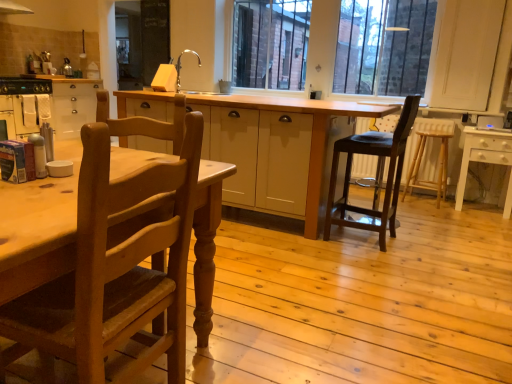
You are a GUI agent. You are given a task and a screenshot of the screen. Output one action in this format:
    pyautogui.click(x=<x>, y=<y>)
    Task: Click on the dark brown wood stool at center-right, placed as the first chair when sorted from right to left
    The height and width of the screenshot is (384, 512).
    Given the screenshot: What is the action you would take?
    pyautogui.click(x=387, y=177)

This screenshot has height=384, width=512. What do you see at coordinates (423, 154) in the screenshot? I see `light brown wooden bar stool at right` at bounding box center [423, 154].

I want to click on silver metallic sink at upper center, so click(195, 70).

The height and width of the screenshot is (384, 512). In order to click on light brown wood chair at left, the second chair in the right-to-left sequence in this screenshot , I will do `click(114, 269)`.

In order to face metallic silver oven at left, should I rotate leftwards or rightwards?

To face it directly, rotate left by 29.960 degrees.

Describe the element at coordinates (25, 113) in the screenshot. I see `metallic silver oven at left` at that location.

Locate an element on the screen. The height and width of the screenshot is (384, 512). light wood table at center, which appears as the 2th table when viewed from the right is located at coordinates (277, 150).

Is white matte cabinet at left wider or thinner than dark brown wood stool at center-right, which appears as the second chair when viewed from the front?

Clearly, white matte cabinet at left has more width compared to dark brown wood stool at center-right, which appears as the second chair when viewed from the front.

Find the location of `cabinetry on the left of dark brown wood stool at center-right, placed as the first chair when sorted from right to left`. cabinetry on the left of dark brown wood stool at center-right, placed as the first chair when sorted from right to left is located at coordinates (50, 104).

Which is closer, (41,99) or (346,141)?

Clearly, point (41,99) is more distant from the camera than point (346,141).

Considering the sizes of white matte cabinet at left and dark brown wood stool at center-right, placed as the first chair when sorted from right to left, in the image, is white matte cabinet at left taller or shorter than dark brown wood stool at center-right, placed as the first chair when sorted from right to left,?

Considering their sizes, white matte cabinet at left has less height than dark brown wood stool at center-right, placed as the first chair when sorted from right to left.

Could you measure the distance between white glossy table at right, marked as the 1th table in a right-to-left arrangement, and dark brown wood stool at center-right, placed as the 1th chair when sorted from back to front?

They are 1.31 meters apart.

Is point (509, 180) behind point (390, 163)?

Yes, point (509, 180) is farther from viewer.

Is white glossy table at right, marked as the 1th table in a right-to-left arrangement, further to the viewer compared to dark brown wood stool at center-right, placed as the 1th chair when sorted from back to front?

Yes, the depth of white glossy table at right, marked as the 1th table in a right-to-left arrangement, is greater than that of dark brown wood stool at center-right, placed as the 1th chair when sorted from back to front.

You are a GUI agent. You are given a task and a screenshot of the screen. Output one action in this format:
    pyautogui.click(x=<x>, y=<y>)
    Task: Click on the 2nd table behind the dark brown wood stool at center-right, which appears as the second chair when viewed from the front, counting from the anchor's position
    The image size is (512, 384).
    Given the screenshot: What is the action you would take?
    pyautogui.click(x=485, y=159)

Which of these two, light wood table at center, which appears as the 2th table when viewed from the right, or white glossy table at right, marked as the 1th table in a right-to-left arrangement, is smaller?

white glossy table at right, marked as the 1th table in a right-to-left arrangement.

What's the angular difference between light wood table at center, which is the first table from left to right, and white glossy table at right, positioned as the second table in left-to-right order,'s facing directions?

There is a 0.727-degree angle between the facing directions of light wood table at center, which is the first table from left to right, and white glossy table at right, positioned as the second table in left-to-right order.

Is light wood table at center, which appears as the 2th table when viewed from the right, wider than white glossy table at right, marked as the 1th table in a right-to-left arrangement?

Correct, the width of light wood table at center, which appears as the 2th table when viewed from the right, exceeds that of white glossy table at right, marked as the 1th table in a right-to-left arrangement.

Are light wood table at center, which appears as the 2th table when viewed from the right, and white glossy table at right, marked as the 1th table in a right-to-left arrangement, making contact?

No, light wood table at center, which appears as the 2th table when viewed from the right, is not beside white glossy table at right, marked as the 1th table in a right-to-left arrangement.

Consider the image. From the image's perspective, is white glossy table at right, positioned as the second table in left-to-right order, over white matte cabinet at left?

No, from the image's perspective, white glossy table at right, positioned as the second table in left-to-right order, is not on top of white matte cabinet at left.

Is white glossy table at right, marked as the 1th table in a right-to-left arrangement, oriented away from white matte cabinet at left?

No, white matte cabinet at left is not at the back of white glossy table at right, marked as the 1th table in a right-to-left arrangement.

Is white glossy table at right, positioned as the second table in left-to-right order, closer to the viewer compared to white matte cabinet at left?

Yes, white glossy table at right, positioned as the second table in left-to-right order, is closer to the viewer.

Find the location of a particular element. the 2nd table positioned below the white matte cabinet at left (from a real-world perspective) is located at coordinates (485, 159).

Considering the positions of points (332, 176) and (170, 357), is point (332, 176) closer to camera compared to point (170, 357)?

No, it is not.

Would you say dark brown wood stool at center-right, placed as the first chair when sorted from right to left, is inside or outside light brown wood chair at left, which is counted as the 2th chair, starting from the back?

dark brown wood stool at center-right, placed as the first chair when sorted from right to left, is not inside light brown wood chair at left, which is counted as the 2th chair, starting from the back, it's outside.

Measure the distance between dark brown wood stool at center-right, placed as the 1th chair when sorted from back to front, and light brown wood chair at left, the 1th chair viewed from the left.

1.90 meters.

Considering the sizes of objects dark brown wood stool at center-right, which appears as the second chair when viewed from the front, and light brown wood chair at left, which is counted as the 2th chair, starting from the back, in the image provided, who is smaller, dark brown wood stool at center-right, which appears as the second chair when viewed from the front, or light brown wood chair at left, which is counted as the 2th chair, starting from the back,?

Smaller between the two is light brown wood chair at left, which is counted as the 2th chair, starting from the back.

Considering the relative sizes of white matte cabinet at left and light wood table at center, which is the first table from left to right, in the image provided, is white matte cabinet at left thinner than light wood table at center, which is the first table from left to right,?

Indeed, white matte cabinet at left has a lesser width compared to light wood table at center, which is the first table from left to right.

Is white matte cabinet at left to the left of light wood table at center, which appears as the 2th table when viewed from the right, from the viewer's perspective?

Indeed, white matte cabinet at left is positioned on the left side of light wood table at center, which appears as the 2th table when viewed from the right.

Could you tell me if white matte cabinet at left is turned towards light wood table at center, which appears as the 2th table when viewed from the right?

Yes, white matte cabinet at left faces towards light wood table at center, which appears as the 2th table when viewed from the right.

Looking at this image, from a real-world perspective, is white matte cabinet at left positioned above or below light wood table at center, which is the first table from left to right?

white matte cabinet at left is situated higher than light wood table at center, which is the first table from left to right, in the real world.

Looking at this image, which object is positioned more to the left, white glossy table at right, marked as the 1th table in a right-to-left arrangement, or black plastic toaster at upper left?

From the viewer's perspective, black plastic toaster at upper left appears more on the left side.

From a real-world perspective, who is located higher, white glossy table at right, positioned as the second table in left-to-right order, or black plastic toaster at upper left?

black plastic toaster at upper left, from a real-world perspective.

Is white glossy table at right, marked as the 1th table in a right-to-left arrangement, directly adjacent to black plastic toaster at upper left?

No, white glossy table at right, marked as the 1th table in a right-to-left arrangement, is not next to black plastic toaster at upper left.

Is white glossy table at right, marked as the 1th table in a right-to-left arrangement, wider or thinner than black plastic toaster at upper left?

white glossy table at right, marked as the 1th table in a right-to-left arrangement, is thinner than black plastic toaster at upper left.

This screenshot has width=512, height=384. I want to click on chair that is the 1st one when counting downward from the white matte cabinet at left (from the image's perspective), so click(387, 177).

The image size is (512, 384). I want to click on table on the right of the dark brown wood stool at center-right, which appears as the second chair when viewed from the front, so click(485, 159).

When comparing their distances from dark brown wood stool at center-right, which appears as the second chair when viewed from the front, does white matte cabinet at left or light brown wooden bar stool at right seem further?

white matte cabinet at left lies further to dark brown wood stool at center-right, which appears as the second chair when viewed from the front, than the other object.

From the image, which object appears to be nearer to white glossy table at right, positioned as the second table in left-to-right order, black plastic toaster at upper left or light brown wood chair at left, the 1th chair viewed from the left?

light brown wood chair at left, the 1th chair viewed from the left, is closer to white glossy table at right, positioned as the second table in left-to-right order.

In the scene shown: Which object lies further to the anchor point silver metallic sink at upper center, white matte cabinet at left or light brown wood chair at left, the second chair in the right-to-left sequence?

The object further to silver metallic sink at upper center is light brown wood chair at left, the second chair in the right-to-left sequence.

Estimate the real-world distances between objects in this image. Which object is further from light brown wooden bar stool at right, silver metallic sink at upper center or dark brown wood stool at center-right, placed as the 1th chair when sorted from back to front?

Among the two, silver metallic sink at upper center is located further to light brown wooden bar stool at right.

Looking at the image, which one is located further to metallic silver oven at left, white glossy table at right, marked as the 1th table in a right-to-left arrangement, or black plastic toaster at upper left?

white glossy table at right, marked as the 1th table in a right-to-left arrangement.

Looking at the image, which one is located closer to black plastic toaster at upper left, silver metallic sink at upper center or light brown wooden bar stool at right?

Among the two, silver metallic sink at upper center is located nearer to black plastic toaster at upper left.

From the picture: Considering their positions, is metallic silver oven at left positioned further to black plastic toaster at upper left than light brown wooden bar stool at right?

light brown wooden bar stool at right is further to black plastic toaster at upper left.

Based on their spatial positions, is white matte cabinet at left or light wood table at center, which appears as the 2th table when viewed from the right, closer to black plastic toaster at upper left?

white matte cabinet at left is positioned closer to the anchor black plastic toaster at upper left.

At what (x,y) coordinates should I click in order to perform the action: click on cabinetry located between metallic silver oven at left and dark brown wood stool at center-right, the second chair from the left, in the left-right direction. Please return your answer as a coordinate pair (x, y). Looking at the image, I should click on (50, 104).

The height and width of the screenshot is (384, 512). Find the location of `cabinetry located between black plastic toaster at upper left and white glossy table at right, positioned as the second table in left-to-right order, in the left-right direction`. cabinetry located between black plastic toaster at upper left and white glossy table at right, positioned as the second table in left-to-right order, in the left-right direction is located at coordinates (50, 104).

Identify the location of sink located between light brown wood chair at left, the first chair from the front, and light brown wooden bar stool at right in the depth direction. The height and width of the screenshot is (384, 512). (195, 70).

You are a GUI agent. You are given a task and a screenshot of the screen. Output one action in this format:
    pyautogui.click(x=<x>, y=<y>)
    Task: Click on the table between black plastic toaster at upper left and light brown wooden bar stool at right in the horizontal direction
    
    Given the screenshot: What is the action you would take?
    pyautogui.click(x=277, y=150)